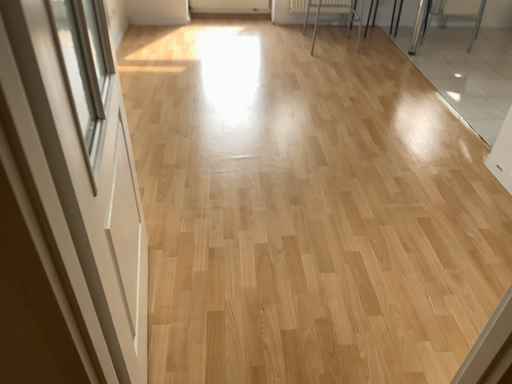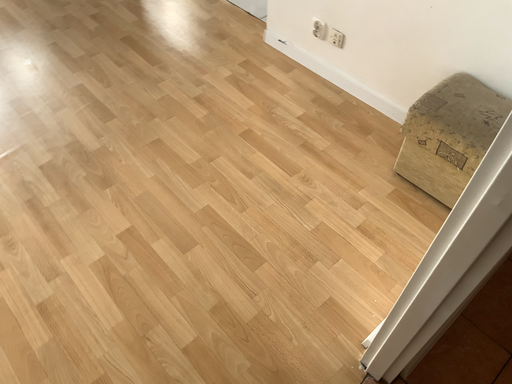
Question: Which way did the camera rotate in the video?

Choices:
 (A) rotated downward
 (B) rotated upward

Answer: (A)